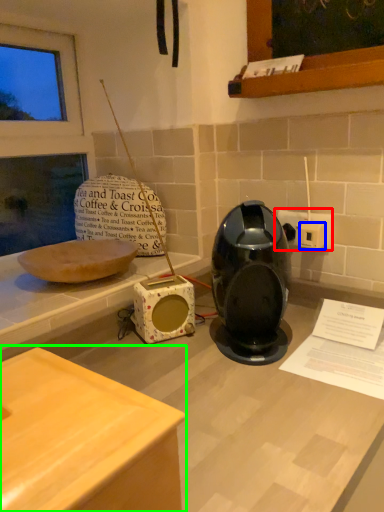
Question: Considering the real-world distances, which object is farthest from electric outlet (highlighted by a red box)? electric outlet (highlighted by a blue box) or table (highlighted by a green box)?

Choices:
 (A) electric outlet
 (B) table

Answer: (B)